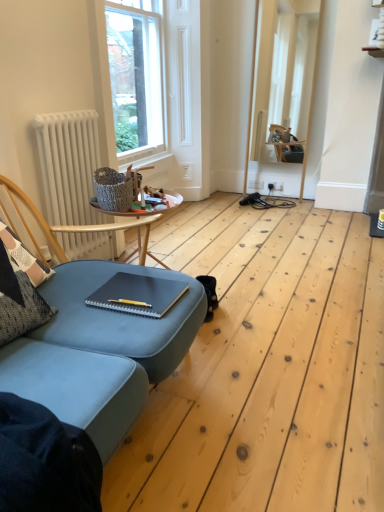
I want to click on white wooden frame at upper center, so click(282, 85).

Is white matte radiator at left in front of or behind matte black notebook at center in the image?

Visually, white matte radiator at left is located behind matte black notebook at center.

Can you confirm if white matte radiator at left is smaller than matte black notebook at center?

No, white matte radiator at left is not smaller than matte black notebook at center.

From the image's perspective, which is above, white matte radiator at left or matte black notebook at center?

white matte radiator at left.

How far apart are white wooden frame at upper center and white matte radiator at left?

white wooden frame at upper center is 7.68 feet away from white matte radiator at left.

Which of these two, white wooden frame at upper center or white matte radiator at left, stands taller?

white wooden frame at upper center is taller.

Is white wooden frame at upper center to the left of white matte radiator at left from the viewer's perspective?

No, white wooden frame at upper center is not to the left of white matte radiator at left.

In the scene shown: Which object is closer to the camera taking this photo, white wooden frame at upper center or white matte radiator at left?

white matte radiator at left is more forward.

Which point is more distant from viewer, (149, 99) or (123, 283)?

Positioned behind is point (149, 99).

Can you confirm if clear glass window at upper center is thinner than matte black notebook at center?

Yes, clear glass window at upper center is thinner than matte black notebook at center.

Which is more to the right, clear glass window at upper center or matte black notebook at center?

Positioned to the right is matte black notebook at center.

Between point (119, 284) and point (136, 47), which one is positioned behind?

The point (136, 47) is farther.

From the image's perspective, is matte black notebook at center located beneath clear glass window at upper center?

Yes.

Is matte black notebook at center wider or thinner than clear glass window at upper center?

In the image, matte black notebook at center appears to be wider than clear glass window at upper center.

Can you confirm if matte black notebook at center is positioned to the right of clear glass window at upper center?

Yes, matte black notebook at center is to the right of clear glass window at upper center.

Consider the image. Between clear glass window at upper center and white wooden frame at upper center, which one has smaller width?

white wooden frame at upper center.

Between clear glass window at upper center and white wooden frame at upper center, which one appears on the right side from the viewer's perspective?

white wooden frame at upper center is more to the right.

Who is taller, clear glass window at upper center or white wooden frame at upper center?

With more height is white wooden frame at upper center.

Is clear glass window at upper center closer to camera compared to white wooden frame at upper center?

Yes, clear glass window at upper center is closer to the viewer.

Does white wooden frame at upper center turn towards clear glass window at upper center?

No, white wooden frame at upper center is not oriented towards clear glass window at upper center.

Is white wooden frame at upper center not near clear glass window at upper center?

That's right, there is a large distance between white wooden frame at upper center and clear glass window at upper center.

Based on the photo, can you confirm if white wooden frame at upper center is taller than clear glass window at upper center?

Indeed, white wooden frame at upper center has a greater height compared to clear glass window at upper center.

Find the location of a particular element. The image size is (384, 512). window that is on the left side of white wooden frame at upper center is located at coordinates coord(137,76).

Are white matte radiator at left and clear glass window at upper center located far from each other?

Yes.

Based on their sizes in the image, would you say white matte radiator at left is bigger or smaller than clear glass window at upper center?

In the image, white matte radiator at left appears to be smaller than clear glass window at upper center.

Is clear glass window at upper center at the back of white matte radiator at left?

No, clear glass window at upper center is not at the back of white matte radiator at left.

In the scene shown: From the image's perspective, who appears lower, white matte radiator at left or clear glass window at upper center?

white matte radiator at left appears lower in the image.

In order to click on radiator that appears above the matte black notebook at center (from the image's perspective) in this screenshot , I will do `click(69, 165)`.

Where is `window frame on the right of the white matte radiator at left`? window frame on the right of the white matte radiator at left is located at coordinates (282, 85).

When comparing their distances from matte black notebook at center, does white matte radiator at left or clear glass window at upper center seem closer?

The object closer to matte black notebook at center is white matte radiator at left.

From the image, which object appears to be nearer to matte black notebook at center, clear glass window at upper center or white wooden frame at upper center?

clear glass window at upper center is closer to matte black notebook at center.

Consider the image. When comparing their distances from white wooden frame at upper center, does white matte radiator at left or clear glass window at upper center seem closer?

Based on the image, clear glass window at upper center appears to be nearer to white wooden frame at upper center.

Looking at the image, which one is located further to white wooden frame at upper center, clear glass window at upper center or white matte radiator at left?

white matte radiator at left is further to white wooden frame at upper center.

Looking at this image, which object lies nearer to the anchor point clear glass window at upper center, matte black notebook at center or white wooden frame at upper center?

Based on the image, white wooden frame at upper center appears to be nearer to clear glass window at upper center.

Based on their spatial positions, is clear glass window at upper center or matte black notebook at center further from white wooden frame at upper center?

The object further to white wooden frame at upper center is matte black notebook at center.

Looking at the image, which one is located further to clear glass window at upper center, white wooden frame at upper center or matte black notebook at center?

matte black notebook at center is further to clear glass window at upper center.

Looking at the image, which one is located closer to white wooden frame at upper center, white matte radiator at left or matte black notebook at center?

The object closer to white wooden frame at upper center is white matte radiator at left.

Identify the location of window positioned between matte black notebook at center and white wooden frame at upper center from near to far. The width and height of the screenshot is (384, 512). (137, 76).

Locate an element on the screen. This screenshot has height=512, width=384. radiator between clear glass window at upper center and matte black notebook at center vertically is located at coordinates (69, 165).

Where is `window situated between white matte radiator at left and white wooden frame at upper center from left to right`? window situated between white matte radiator at left and white wooden frame at upper center from left to right is located at coordinates (137, 76).

Locate an element on the screen. The image size is (384, 512). radiator between matte black notebook at center and white wooden frame at upper center in the front-back direction is located at coordinates (69, 165).